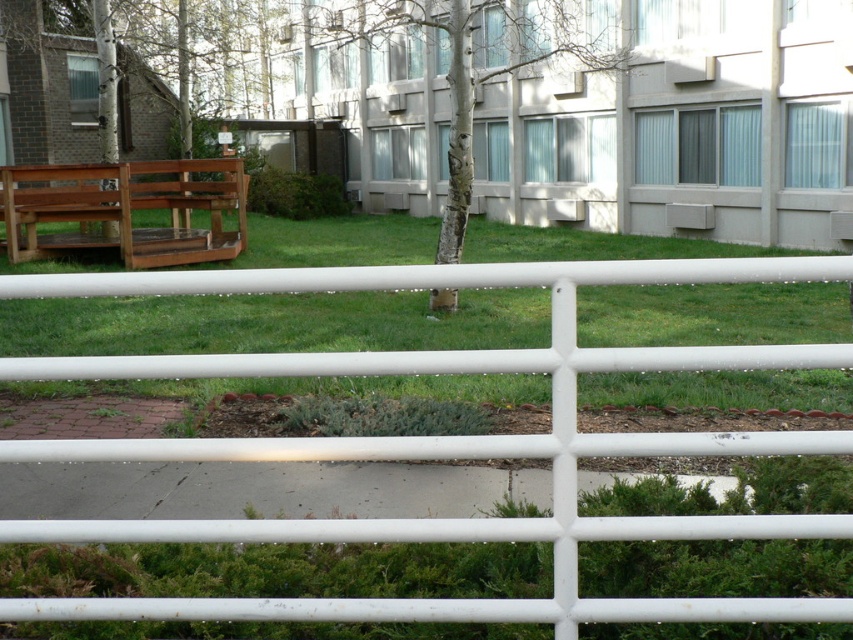
Is point (32, 611) positioned after point (451, 3)?

No, (32, 611) is closer to viewer.

Does white metal fence at center have a greater height compared to smooth bark tree at center?

Incorrect, white metal fence at center's height is not larger of smooth bark tree at center's.

Find the location of a particular element. Image resolution: width=853 pixels, height=640 pixels. white metal fence at center is located at coordinates (436, 440).

From the picture: Does white metal fence at center appear on the right side of wooden bench at left?

Yes, white metal fence at center is to the right of wooden bench at left.

Can you confirm if white metal fence at center is smaller than wooden bench at left?

No.

Does point (784, 525) lie in front of point (218, 241)?

Yes, it is.

At what (x,y) coordinates should I click in order to perform the action: click on white metal fence at center. Please return your answer as a coordinate pair (x, y). This screenshot has width=853, height=640. Looking at the image, I should click on (436, 440).

Is point (749, 388) in front of point (9, 259)?

Yes, point (749, 388) is in front of point (9, 259).

Is green grass at center above wooden bench at left?

Actually, green grass at center is below wooden bench at left.

Locate an element on the screen. The height and width of the screenshot is (640, 853). green grass at center is located at coordinates (271, 323).